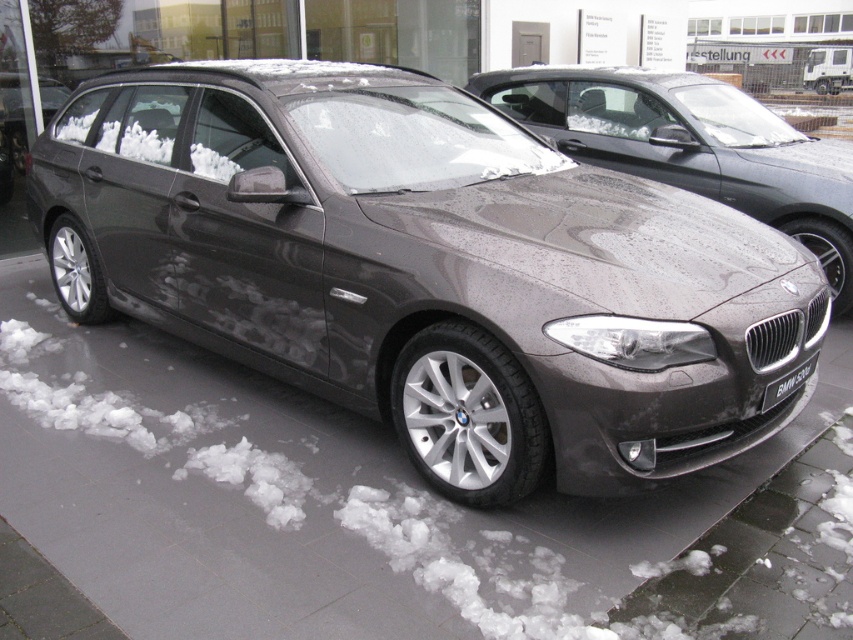
Question: Does satin metallic sedan at center appear over black plastic license plate at center?

Choices:
 (A) no
 (B) yes

Answer: (B)

Question: Can you confirm if satin metallic car at center is bigger than black plastic license plate at center?

Choices:
 (A) no
 (B) yes

Answer: (B)

Question: Among these points, which one is nearest to the camera?

Choices:
 (A) (810, 368)
 (B) (223, 604)
 (C) (770, 216)

Answer: (B)

Question: Among these objects, which one is nearest to the camera?

Choices:
 (A) satin metallic sedan at center
 (B) satin metallic car at center
 (C) black plastic license plate at center

Answer: (B)

Question: Is satin metallic car at center above black plastic license plate at center?

Choices:
 (A) no
 (B) yes

Answer: (B)

Question: Based on their relative distances, which object is farther from the black plastic license plate at center?

Choices:
 (A) gray concrete pavement at center
 (B) satin metallic car at center
 (C) satin metallic sedan at center

Answer: (C)